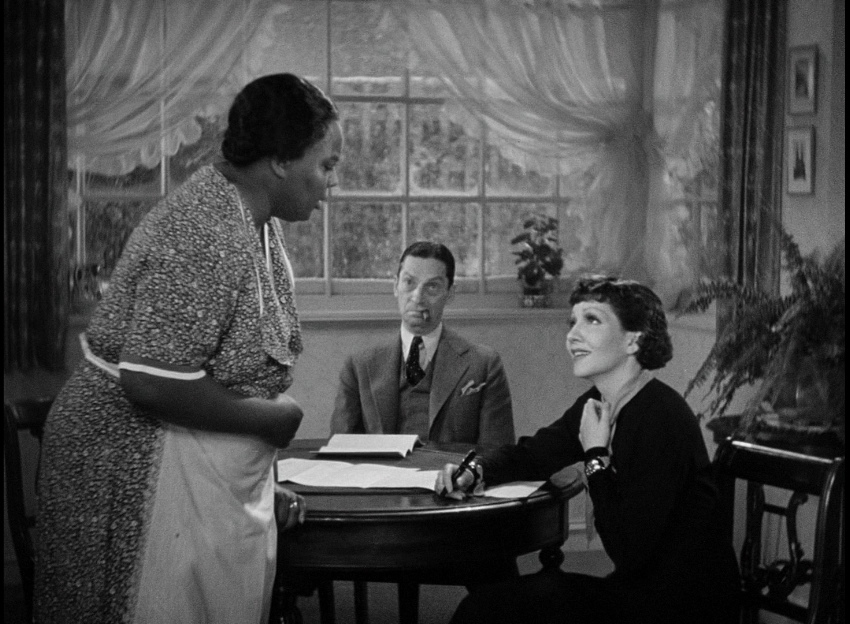
What are the coordinates of `curtain` in the screenshot? It's located at (564, 120), (193, 79).